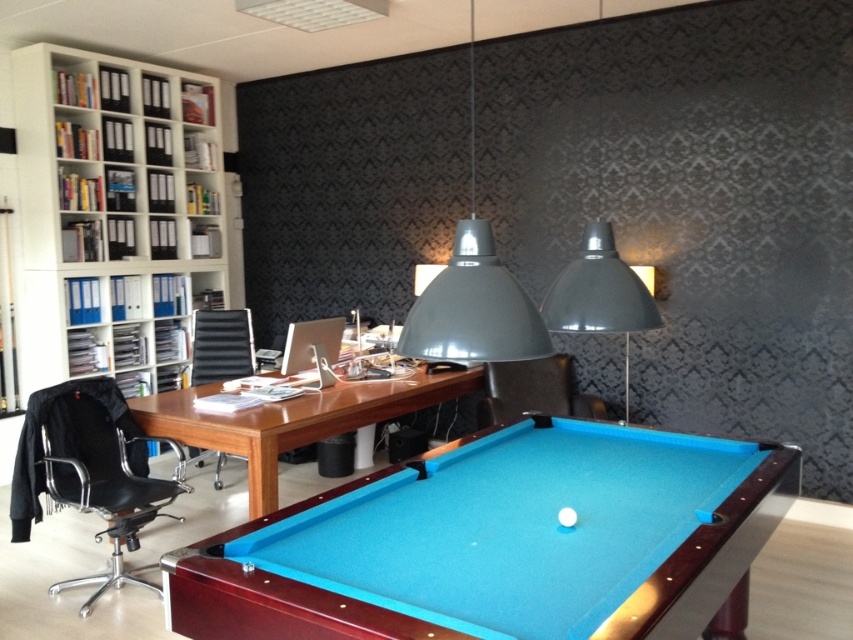
The image size is (853, 640). What do you see at coordinates (498, 541) in the screenshot? I see `blue felt pool table at lower center` at bounding box center [498, 541].

Who is more distant from viewer, (189, 570) or (152, 381)?

Positioned behind is point (152, 381).

The width and height of the screenshot is (853, 640). I want to click on blue felt pool table at lower center, so click(498, 541).

Is blue felt pool table at lower center below black mesh office chair at center?

Correct, blue felt pool table at lower center is located below black mesh office chair at center.

Is point (699, 547) positioned after point (228, 316)?

That is False.

The image size is (853, 640). I want to click on blue felt pool table at lower center, so (x=498, y=541).

Where is `metallic gray pendant light at center`? metallic gray pendant light at center is located at coordinates coord(473,294).

Image resolution: width=853 pixels, height=640 pixels. What are the coordinates of `metallic gray pendant light at center` in the screenshot? It's located at (473, 294).

Where is `metallic gray pendant light at center`? This screenshot has width=853, height=640. metallic gray pendant light at center is located at coordinates (473, 294).